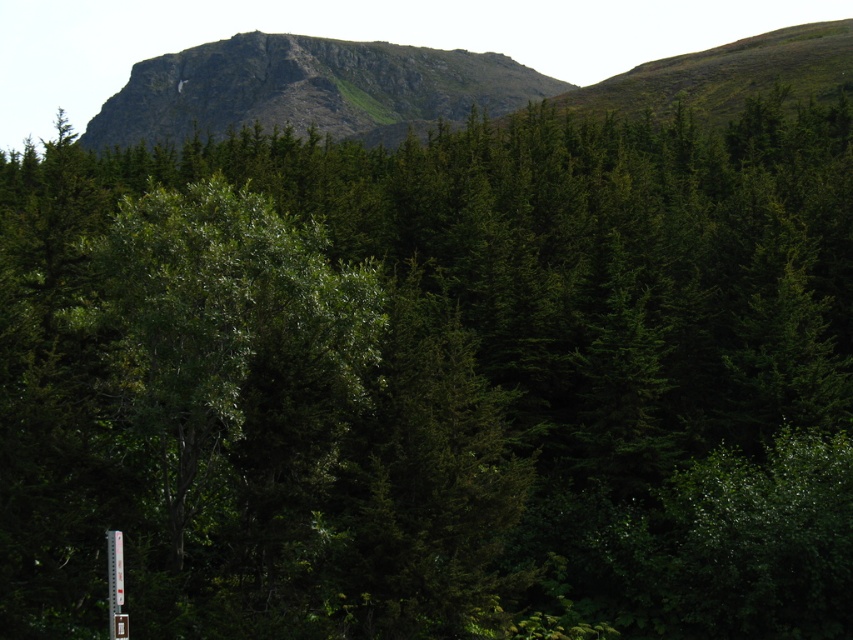
You are hiking in the forest and see the rugged rock mountain at upper center and the white plastic sign at lower left. Which object is positioned to the left when viewed from your perspective?

The rugged rock mountain at upper center is to the left of the white plastic sign at lower left.

You are hiking in the forest and see the rugged rock mountain at upper center and the white plastic sign at lower left. Which object is taller?

The rugged rock mountain at upper center is taller than the white plastic sign at lower left.